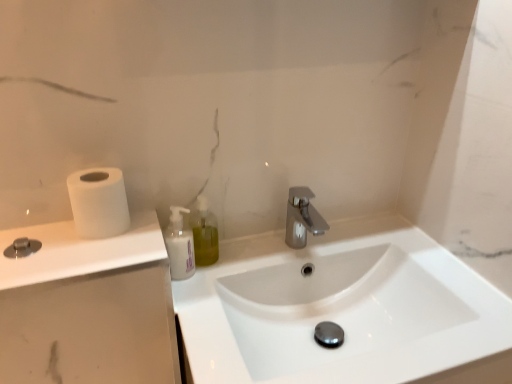
Identify the location of free space that is in between translucent plastic soap dispenser at center and polished chrome faucet at center. (248, 252).